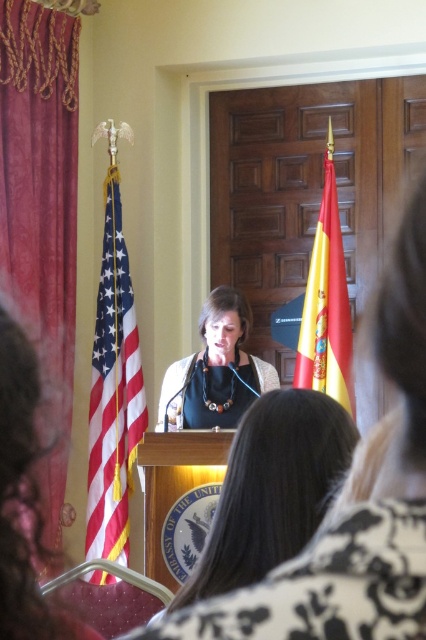
From the picture: You are an event planner setting up a camera for a live stream. The camera is placed at the back of the room, and you need to ensure both the matte black podium at center and the matte black necklace at center are visible in the frame. Given their distance apart, can the camera capture both objects in the same shot?

The matte black podium at center and matte black necklace at center are 3.06 meters apart from each other. Since the camera is placed at the back of the room, it should be able to capture both objects in the same shot as they are within a reasonable distance apart.

You are an event planner arranging seating for a diplomatic reception. You need to place a chair exactly between the american flag at left and the matte black necklace at center. Based on their positions, which side of the chair should face the speaker?

The chair should face the speaker with its back towards the american flag at left since the matte black necklace at center is positioned to the right of the american flag at left, meaning the american flag at left is on the left side of the necklace. Therefore, placing the chair between them would require the chair to face the speaker so that the back is towards the flag and the front towards the necklace.